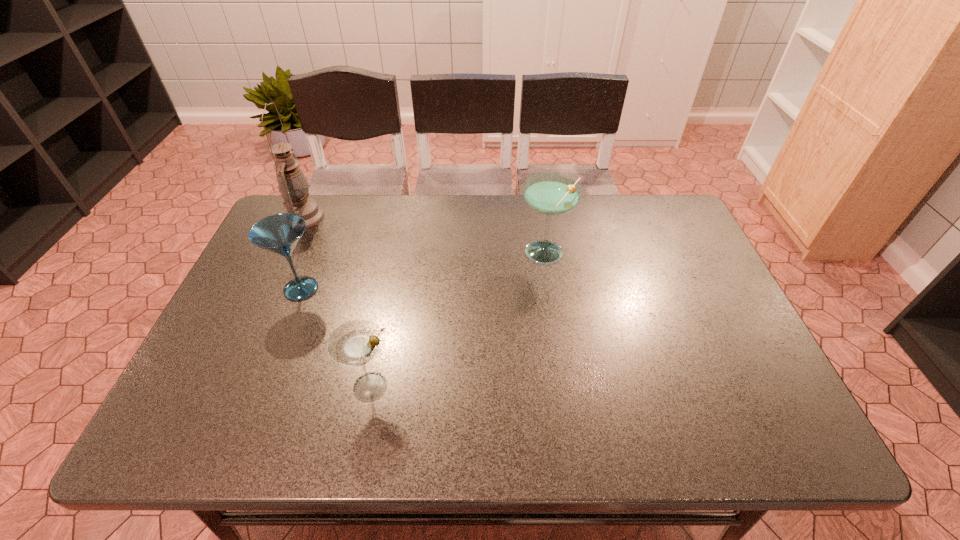
Find the location of a particular element. oil lamp that is at the far edge is located at coordinates (292, 183).

This screenshot has width=960, height=540. In order to click on martini located at the far edge in this screenshot , I will do `click(550, 193)`.

Where is `object that is at the near edge`? This screenshot has height=540, width=960. object that is at the near edge is located at coordinates click(x=355, y=343).

Where is `oil lamp that is at the left edge`? The image size is (960, 540). oil lamp that is at the left edge is located at coordinates (292, 183).

This screenshot has height=540, width=960. In order to click on martini that is at the left edge in this screenshot , I will do `click(280, 233)`.

Locate an element on the screen. The width and height of the screenshot is (960, 540). object that is at the far left corner is located at coordinates (292, 183).

I want to click on vacant space at the far edge of the desktop, so click(632, 220).

This screenshot has width=960, height=540. In order to click on vacant area at the near edge of the desktop in this screenshot , I will do `click(263, 424)`.

Locate an element on the screen. vacant space at the left edge of the desktop is located at coordinates tap(304, 274).

The image size is (960, 540). What are the coordinates of `blank space at the far right corner of the desktop` in the screenshot? It's located at (636, 209).